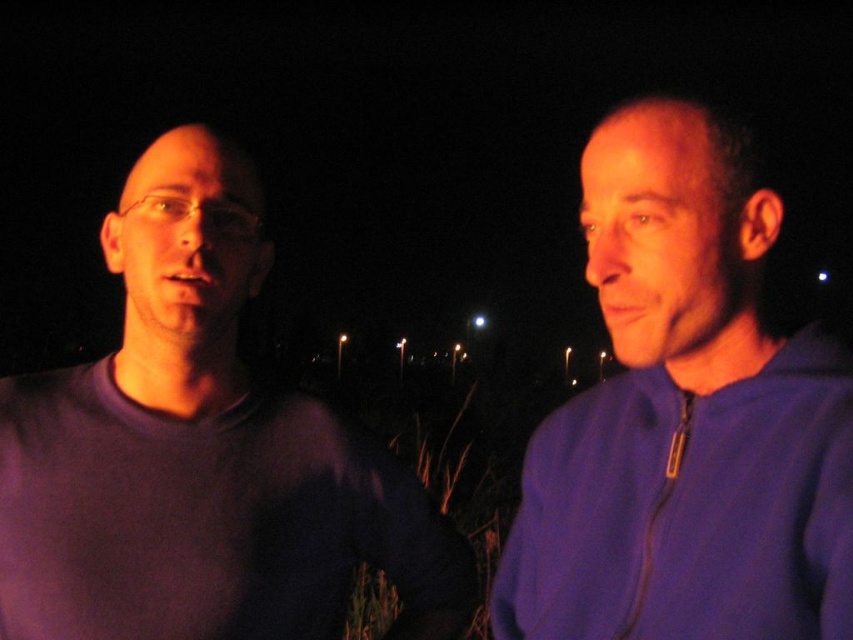
You are standing in the dark night scene and need to locate two specific points. Which of the two points, point (380, 499) or point (763, 342), is positioned further away from you?

Point (380, 499) is behind point (763, 342), so it is positioned further away from you.

In the scene shown: You are holding a camera and want to take a photo of the scene described in the Scene. The camera is currently positioned at point point (78, 410). You want to adjust your position so that you are exactly 4 feet away from the camera. In which direction should you move?

Since the camera is currently at point (78, 410) and you are 3.55 feet away from it, you need to move 0.45 feet further away from the camera to reach the desired 4 feet distance.